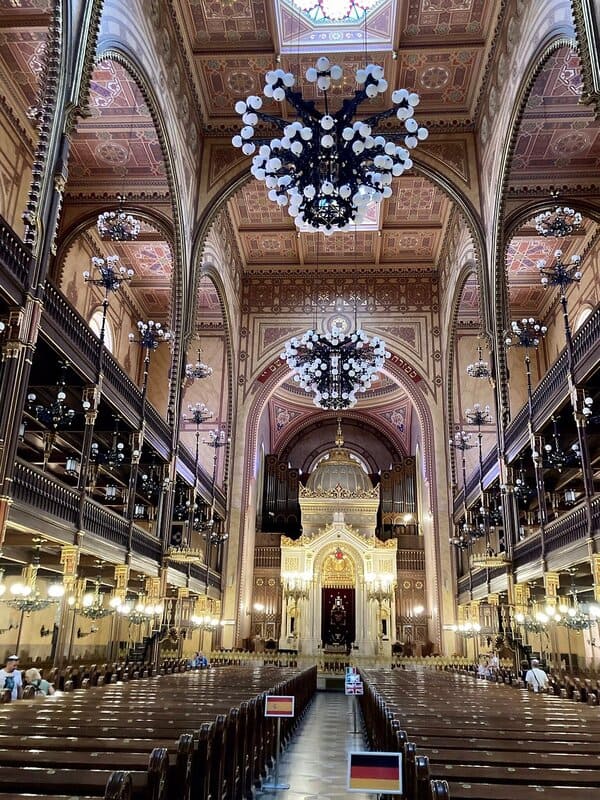
The width and height of the screenshot is (600, 800). What are the coordinates of `fancy chandeliers` in the screenshot? It's located at (337, 377), (356, 132).